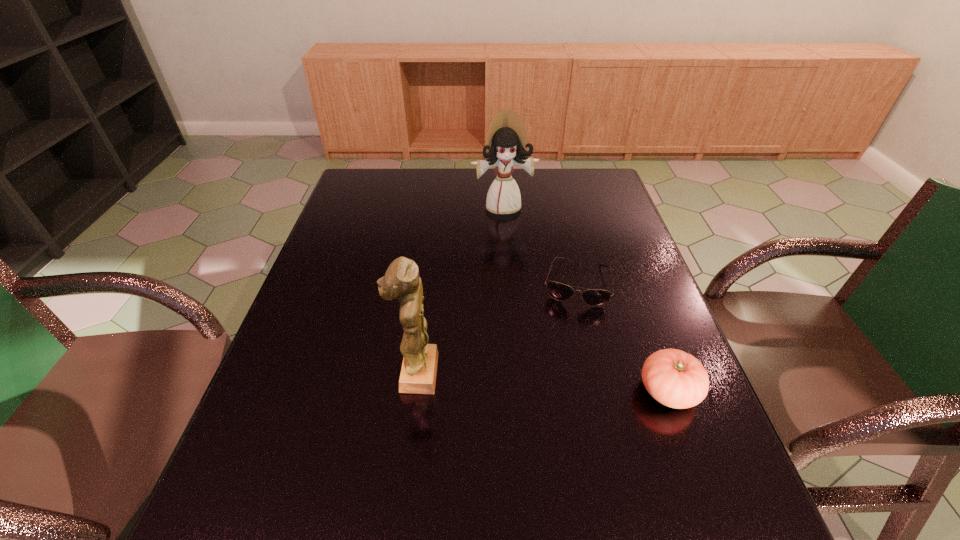
The height and width of the screenshot is (540, 960). Identify the location of figurine. [x=401, y=281].

Find the location of a particular element. The width and height of the screenshot is (960, 540). tomato is located at coordinates [676, 379].

Where is `the farthest object`? Image resolution: width=960 pixels, height=540 pixels. the farthest object is located at coordinates (508, 144).

Locate an element on the screen. The width and height of the screenshot is (960, 540). sunglasses is located at coordinates [593, 297].

Where is `the second farthest object`? Image resolution: width=960 pixels, height=540 pixels. the second farthest object is located at coordinates (593, 297).

At what (x,y) coordinates should I click in order to perform the action: click on vacant space located 0.120m on the front-facing side of the figurine. Please return your answer as a coordinate pair (x, y). The image size is (960, 540). Looking at the image, I should click on (341, 373).

You are a GUI agent. You are given a task and a screenshot of the screen. Output one action in this format:
    pyautogui.click(x=<x>, y=<y>)
    Task: Click on the free space located 0.110m on the front-facing side of the figurine
    The image size is (960, 540).
    Given the screenshot: What is the action you would take?
    pyautogui.click(x=346, y=373)

Image resolution: width=960 pixels, height=540 pixels. I want to click on free location located on the front-facing side of the figurine, so click(x=346, y=373).

I want to click on free space located on the back of the second shortest object, so click(x=620, y=261).

Locate an element on the screen. The height and width of the screenshot is (540, 960). vacant space located 0.090m at the front face of the doll is located at coordinates (512, 235).